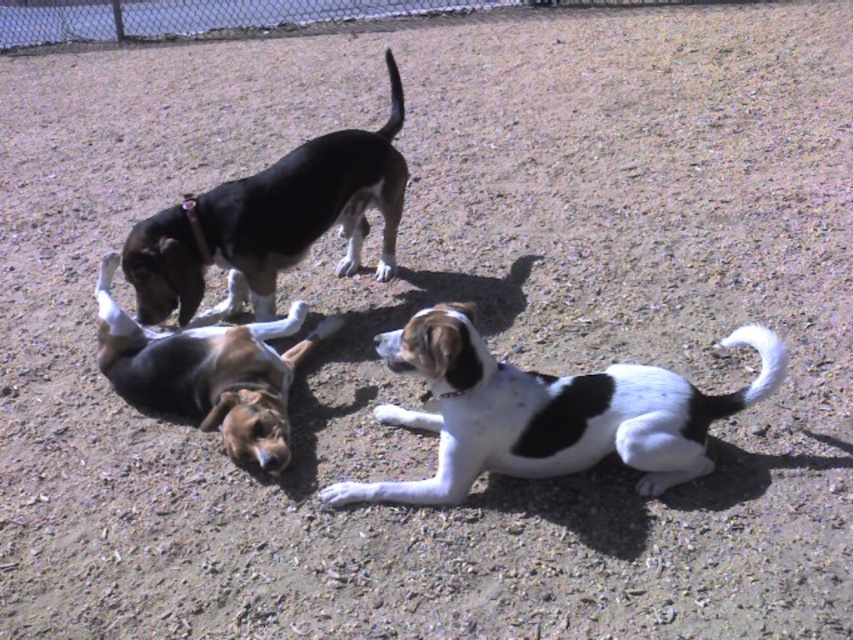
Question: Which of the following is the farthest from the observer?

Choices:
 (A) black and white fur dog at upper left
 (B) brown and white fur dog at lower left

Answer: (A)

Question: Which of the following is the closest to the observer?

Choices:
 (A) (514, 394)
 (B) (343, 196)
 (C) (213, 387)

Answer: (A)

Question: Can you confirm if white-spotted fur dog at center is wider than black and white fur dog at upper left?

Choices:
 (A) no
 (B) yes

Answer: (B)

Question: Which point is farther to the camera?

Choices:
 (A) [434, 323]
 (B) [367, 164]
 (C) [288, 365]
 (D) [329, 16]

Answer: (D)

Question: Can you confirm if white-spotted fur dog at center is positioned above brown and white fur dog at lower left?

Choices:
 (A) no
 (B) yes

Answer: (A)

Question: Does white-spotted fur dog at center appear under brown and white fur dog at lower left?

Choices:
 (A) yes
 (B) no

Answer: (A)